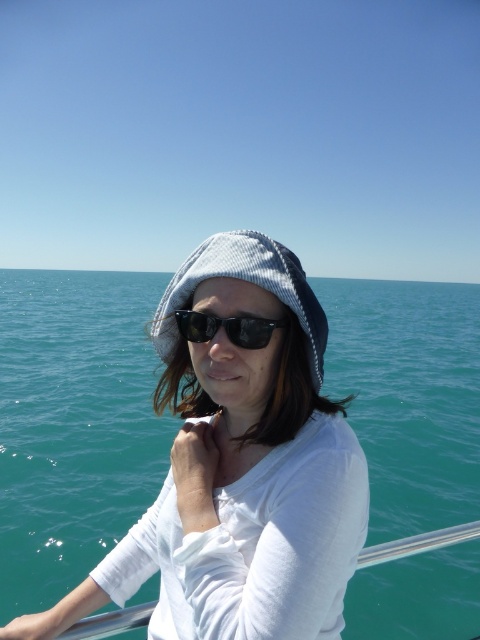
Does woven fabric beanie at center appear under black reflective sunglasses at center?

Actually, woven fabric beanie at center is above black reflective sunglasses at center.

Can you confirm if woven fabric beanie at center is shorter than black reflective sunglasses at center?

No.

Is point (256, 237) closer to viewer compared to point (191, 314)?

No, (256, 237) is further to viewer.

You are a GUI agent. You are given a task and a screenshot of the screen. Output one action in this format:
    pyautogui.click(x=<x>, y=<y>)
    Task: Click on the woven fabric beanie at center
    This screenshot has height=640, width=480.
    Given the screenshot: What is the action you would take?
    pyautogui.click(x=248, y=282)

Does teal water at center have a smaller size compared to woven fabric beanie at center?

No.

Is teal water at center shorter than woven fabric beanie at center?

In fact, teal water at center may be taller than woven fabric beanie at center.

Is point (88, 323) positioned before point (162, 326)?

That is False.

The image size is (480, 640). In order to click on teal water at center in this screenshot , I will do `click(73, 424)`.

Consider the image. Can you confirm if teal water at center is bigger than black reflective sunglasses at center?

Yes, teal water at center is bigger than black reflective sunglasses at center.

Is teal water at center smaller than black reflective sunglasses at center?

Incorrect, teal water at center is not smaller in size than black reflective sunglasses at center.

Between point (384, 529) and point (204, 317), which one is positioned behind?

Positioned behind is point (384, 529).

Find the location of `teal water at center`. teal water at center is located at coordinates (73, 424).